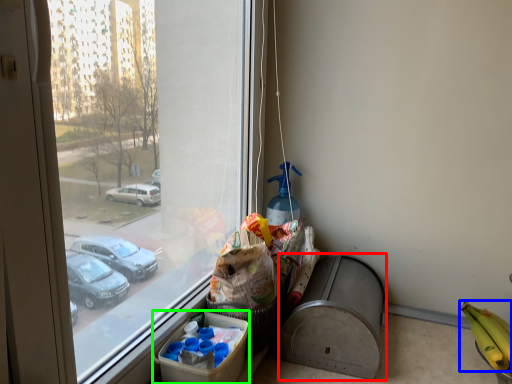
Question: Based on their relative distances, which object is farther from recycling bin (highlighted by a red box)? Choose from banana (highlighted by a blue box) and cardboard box (highlighted by a green box).

Choices:
 (A) banana
 (B) cardboard box

Answer: (A)